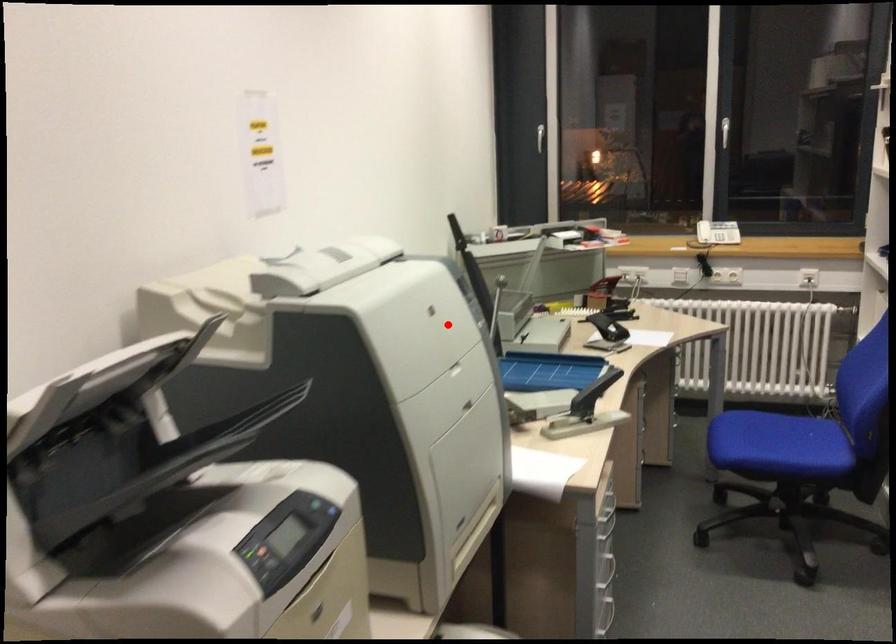
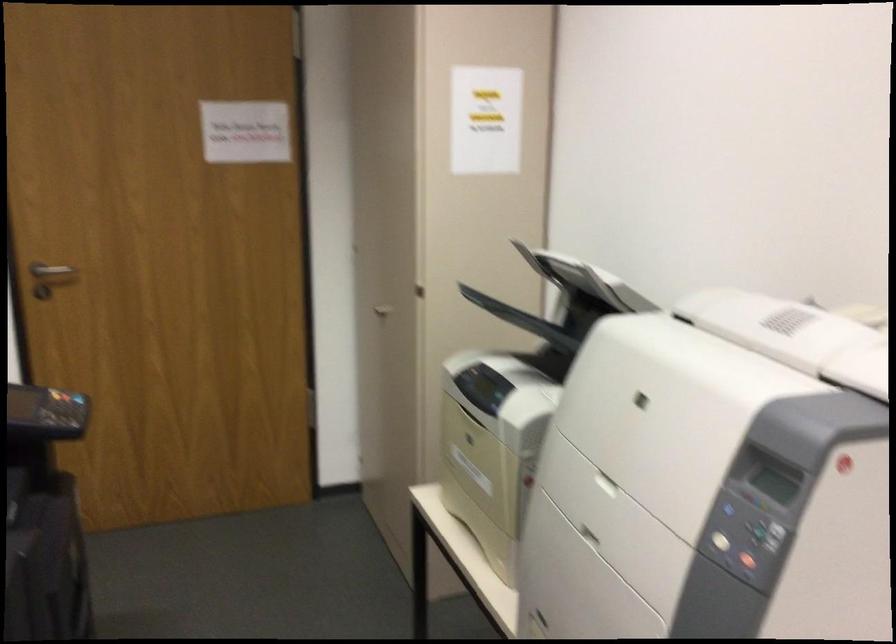
Question: A red point is marked in image1. In image2, is the corresponding 3D point closer to the camera or farther? Reply with the corresponding letter.

Choices:
 (A) The corresponding 3D point is closer.
 (B) The corresponding 3D point is farther.

Answer: (A)